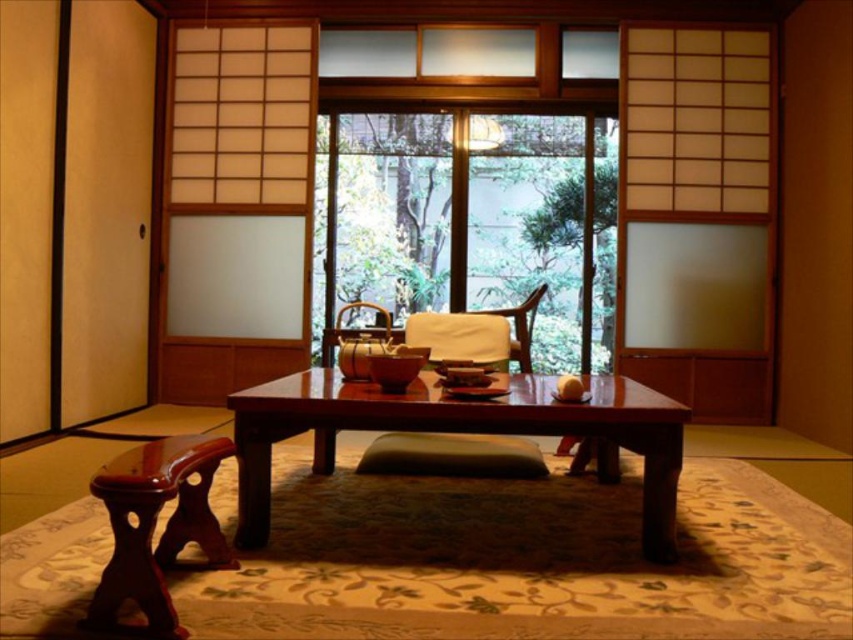
You are sitting on the green fabric cushion at center and want to reach the mahogany wood stool at lower left. Is the stool within your immediate reach?

The mahogany wood stool at lower left is above the green fabric cushion at center, so it is positioned higher and might be out of immediate reach unless you stand up.